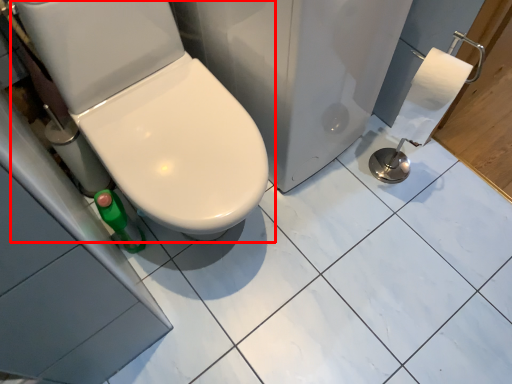
Question: From the image's perspective, what is the correct spatial relationship of toilet (annotated by the red box) in relation to porcelain?

Choices:
 (A) above
 (B) below

Answer: (B)